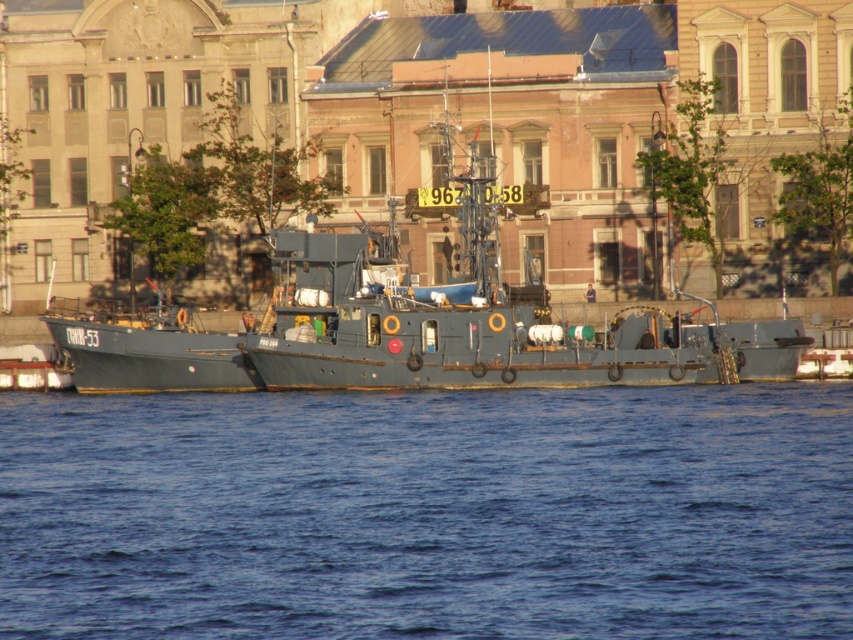
Is point (544, 426) positioned before point (456, 259)?

Yes, point (544, 426) is in front of point (456, 259).

Who is higher up, blue water at center or matte gray boat at center?

matte gray boat at center is above.

At what (x,y) coordinates should I click in order to perform the action: click on blue water at center. Please return your answer as a coordinate pair (x, y). The image size is (853, 640). Looking at the image, I should click on (428, 513).

Image resolution: width=853 pixels, height=640 pixels. Identify the location of blue water at center. (428, 513).